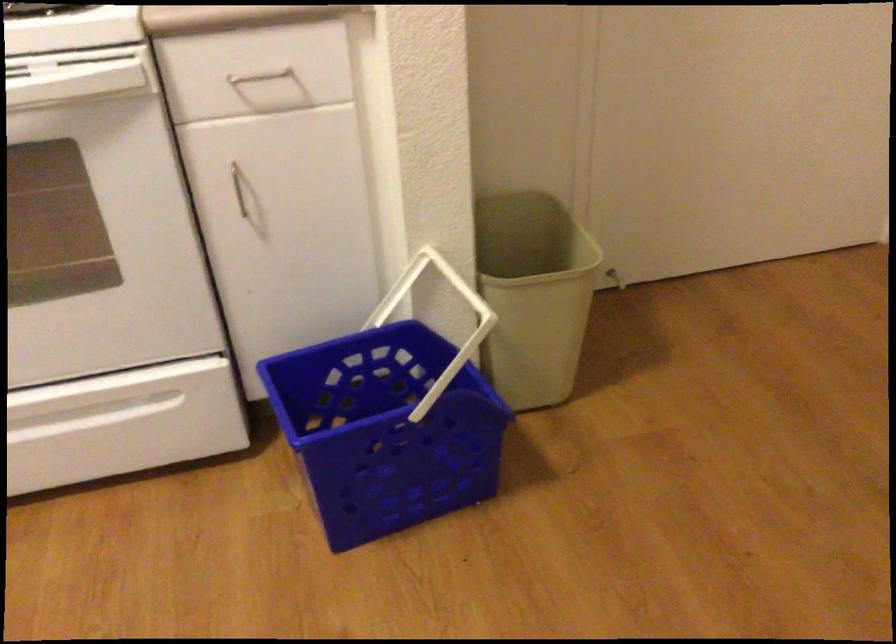
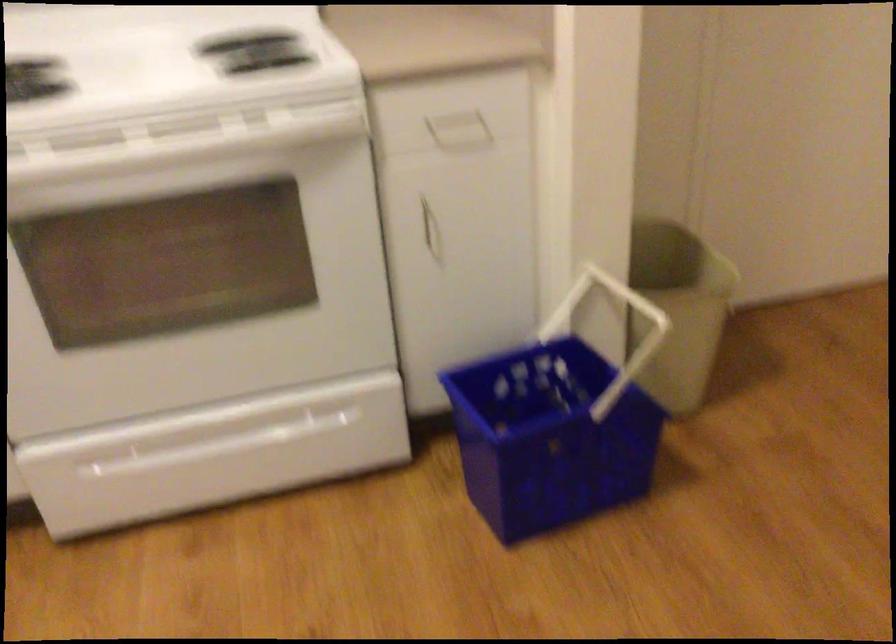
Locate, in the second image, the point that corresponds to the point at 464,317 in the first image.

(616, 330)